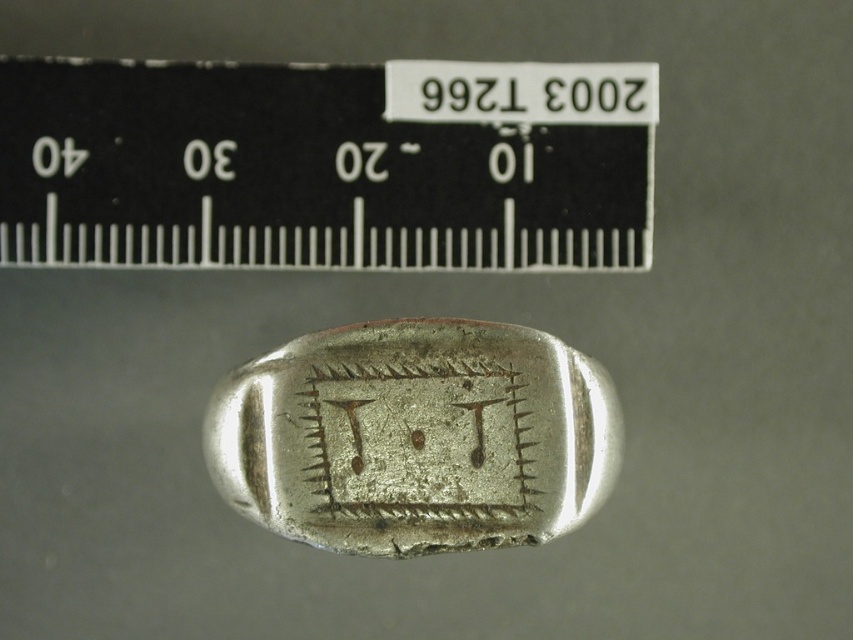
You are an appraiser examining a collection of vintage items. You notice a black plastic ruler at upper center and a shiny silver ring at center. Based on their positions, which item is closer to the right edge of the image?

The shiny silver ring at center is closer to the right edge of the image because the black plastic ruler at upper center is positioned to its left.

You are looking at the image of the metallic object and ruler. There are two points marked on the object. If you were to touch both points with your finger, which point would feel closer to you, point (480, 134) or point (451, 436)?

Point (480, 134) is further to the camera than point (451, 436), so the point closer to you would be point (451, 436).